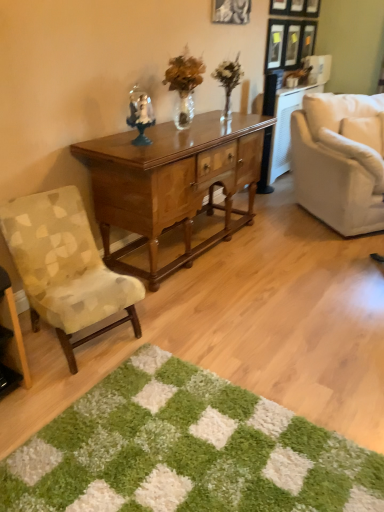
Find the location of `vacant space to the right of translucent glass vase at center`. vacant space to the right of translucent glass vase at center is located at coordinates (253, 120).